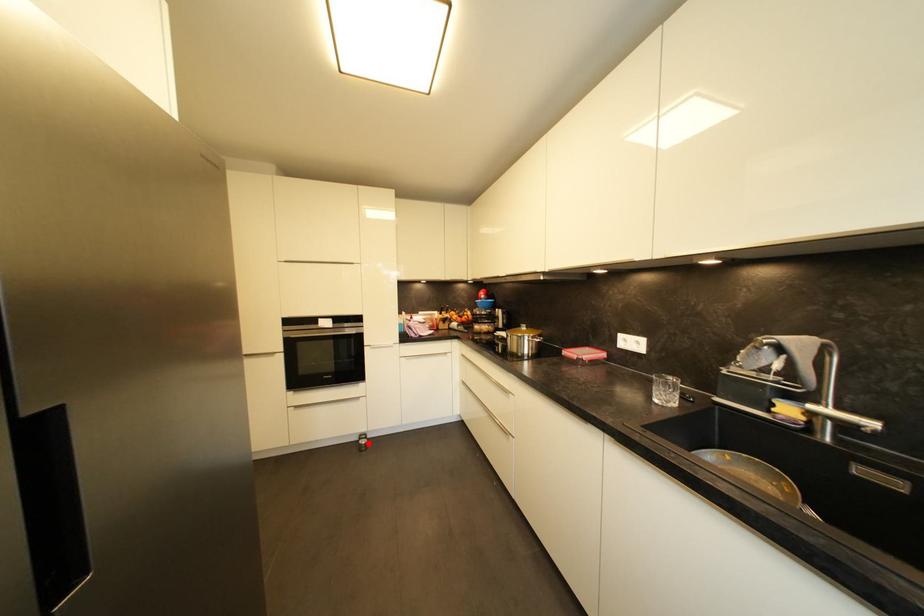
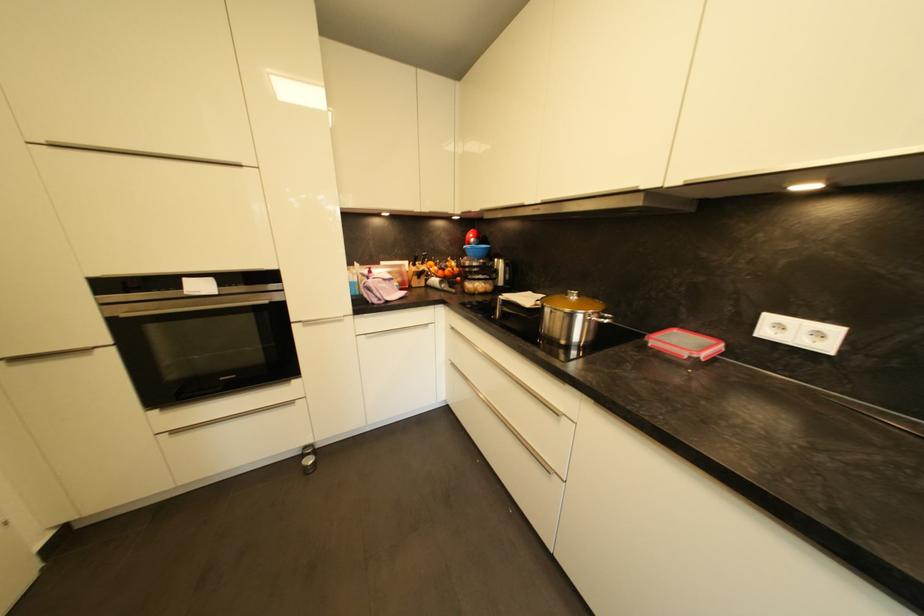
Question: A red point is marked in image1. In image2, is the corresponding 3D point closer to the camera or farther? Reply with the corresponding letter.

Choices:
 (A) The corresponding 3D point is closer.
 (B) The corresponding 3D point is farther.

Answer: (A)